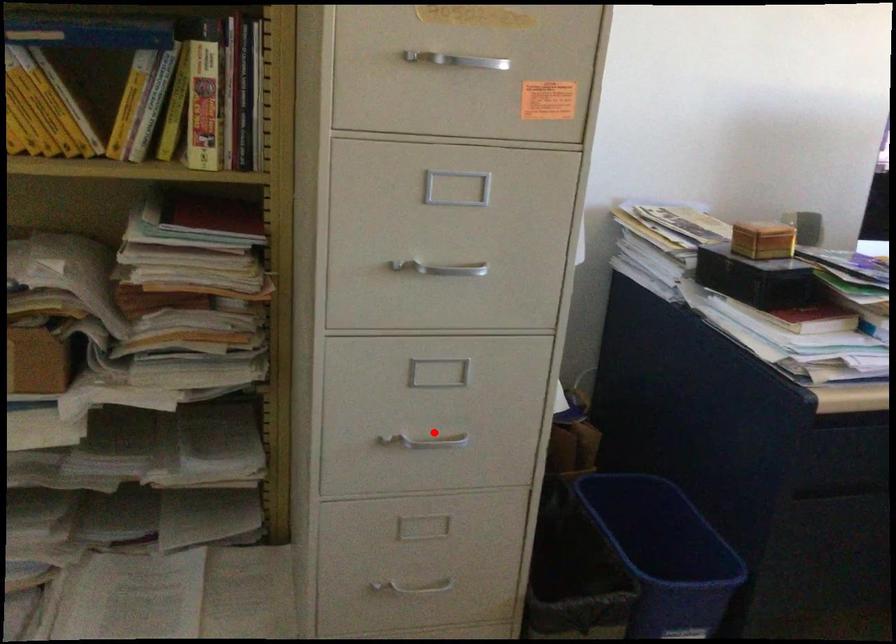
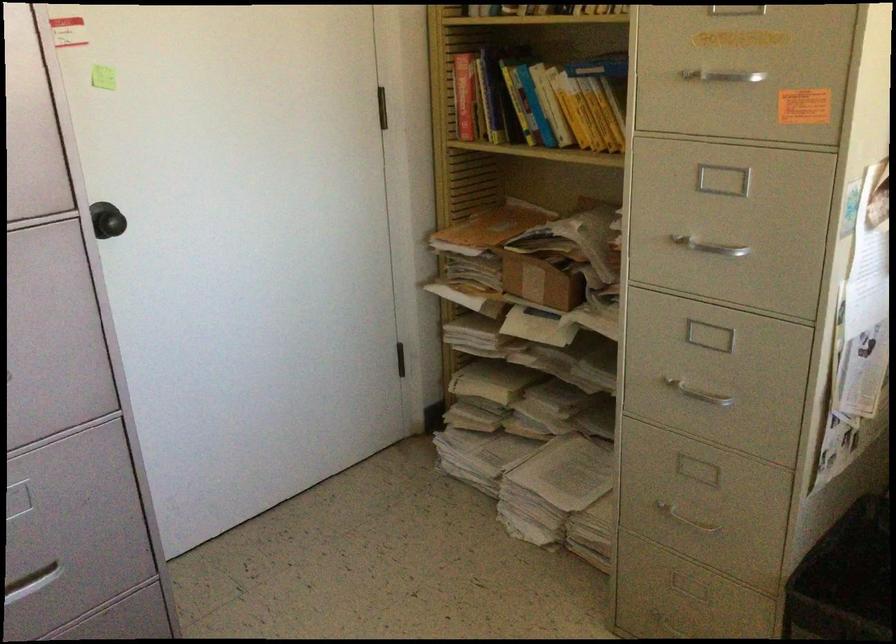
Find the pixel in the second image that matches the highlighted location in the first image.

(699, 391)